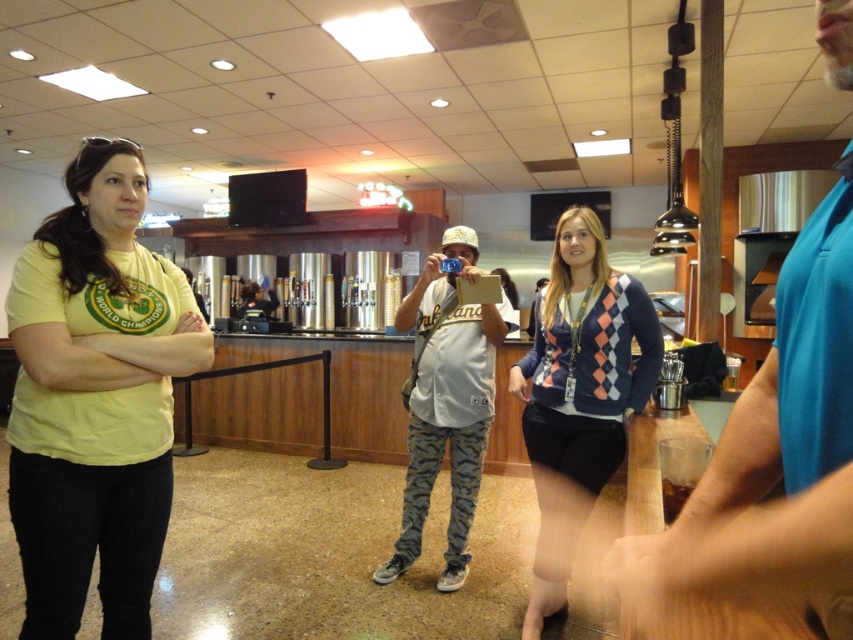
You are standing in the bar and want to locate the yellow matte t shirt at left. Where is the point at (96,397) in relation to it?

The point at (96,397) is on the yellow matte t shirt at left.